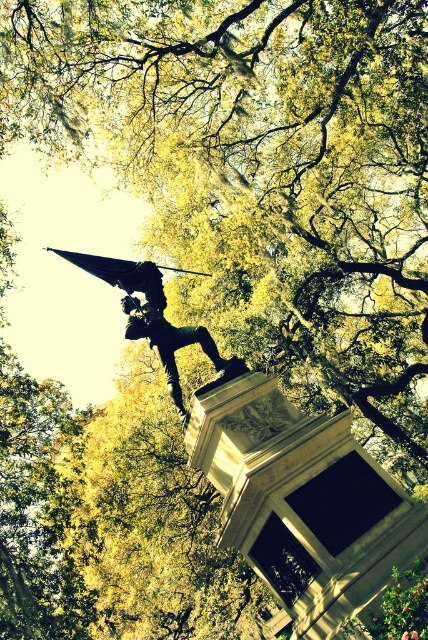
Is shiny bronze statue at center to the right of bronze statue at center from the viewer's perspective?

Correct, you'll find shiny bronze statue at center to the right of bronze statue at center.

Can you confirm if shiny bronze statue at center is positioned below bronze statue at center?

Correct, shiny bronze statue at center is located below bronze statue at center.

Is point (237, 374) less distant than point (178, 346)?

Yes, point (237, 374) is closer to viewer.

Locate an element on the screen. shiny bronze statue at center is located at coordinates (152, 316).